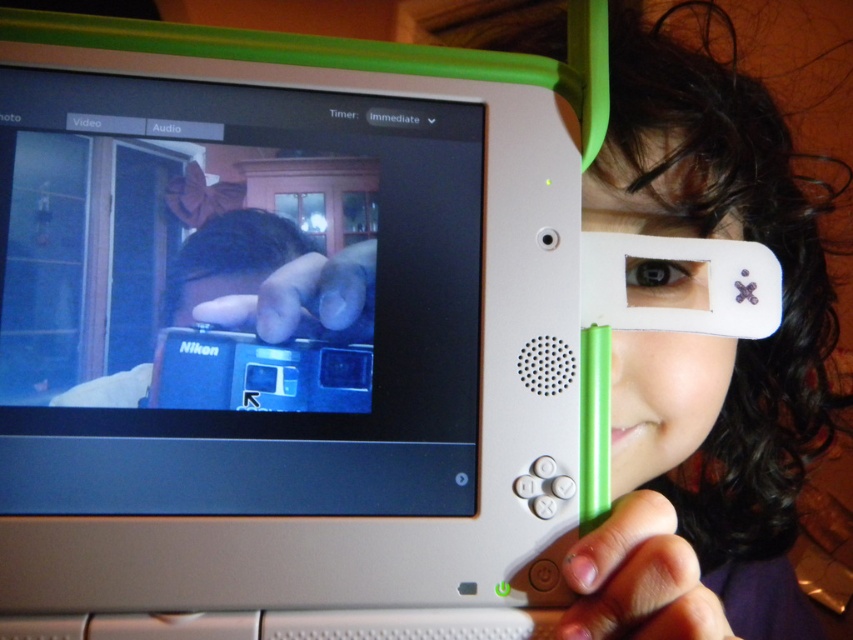
Question: Which point is farther to the camera?

Choices:
 (A) (83, 134)
 (B) (310, 266)

Answer: (B)

Question: Which of the following is the closest to the observer?

Choices:
 (A) metallic blue camera at center
 (B) matte white eye at upper right
 (C) blue plastic camera at center

Answer: (A)

Question: Which point is closer to the camera?

Choices:
 (A) metallic blue camera at center
 (B) blue plastic camera at center
 (C) matte white eye at upper right

Answer: (A)

Question: Does metallic blue camera at center appear under matte white eye at upper right?

Choices:
 (A) no
 (B) yes

Answer: (A)

Question: Is matte white eye at upper right below blue plastic camera at center?

Choices:
 (A) yes
 (B) no

Answer: (B)

Question: Does metallic blue camera at center have a smaller size compared to matte white eye at upper right?

Choices:
 (A) yes
 (B) no

Answer: (A)